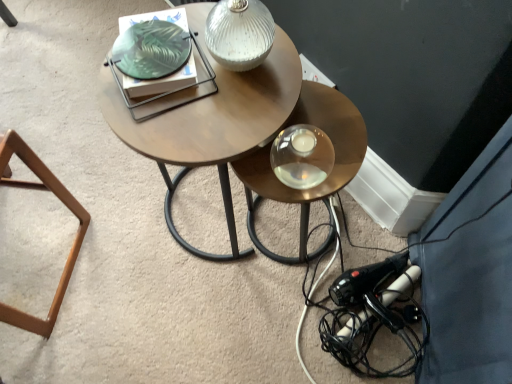
Where is `empty space that is ontop of woodenmaterial/texturecoffee table at center (from a real-world perspective)`? The width and height of the screenshot is (512, 384). empty space that is ontop of woodenmaterial/texturecoffee table at center (from a real-world perspective) is located at coordinates (203, 94).